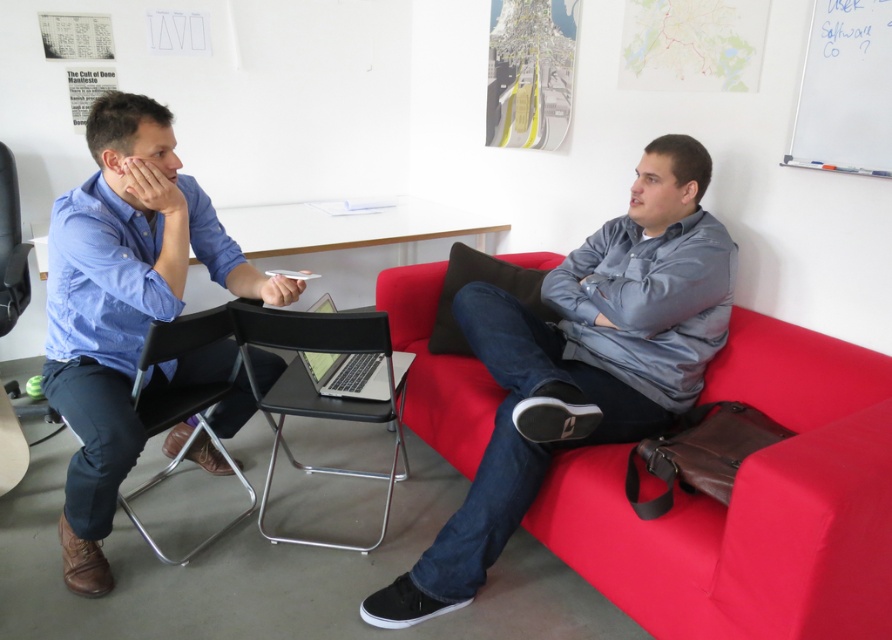
You are standing in the room and want to sit down. Which object, the matte red couch at right or the black leather chair at left, is closer to you based on their positions?

The black leather chair at left is closer to you because it is above the matte red couch at right, indicating it is nearer in the visual perspective.

You are standing in the office and want to hand a document to the person wearing the blue cotton shirt at left. The document is on the matte red couch at right. Can you reach the document without moving from your current position?

The matte red couch at right is closer to the viewer than the blue cotton shirt at left. Since the couch is nearer to you, you can easily reach the document on the matte red couch at right and hand it to the person wearing the blue cotton shirt at left without needing to move.

You are standing in the office and want to hang a picture on the wall above the blue cotton shirt at left and the black leather chair at left. Which object should the picture be placed higher above to ensure it is centered between them?

The picture should be placed higher above the blue cotton shirt at left because it has a greater height compared to the black leather chair at left, so centering between them requires positioning the picture closer to the taller object.